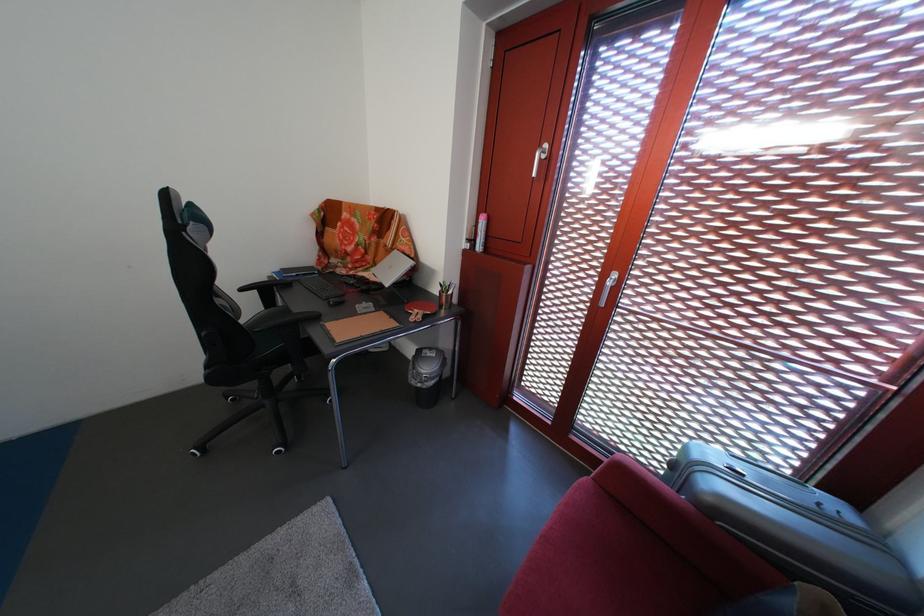
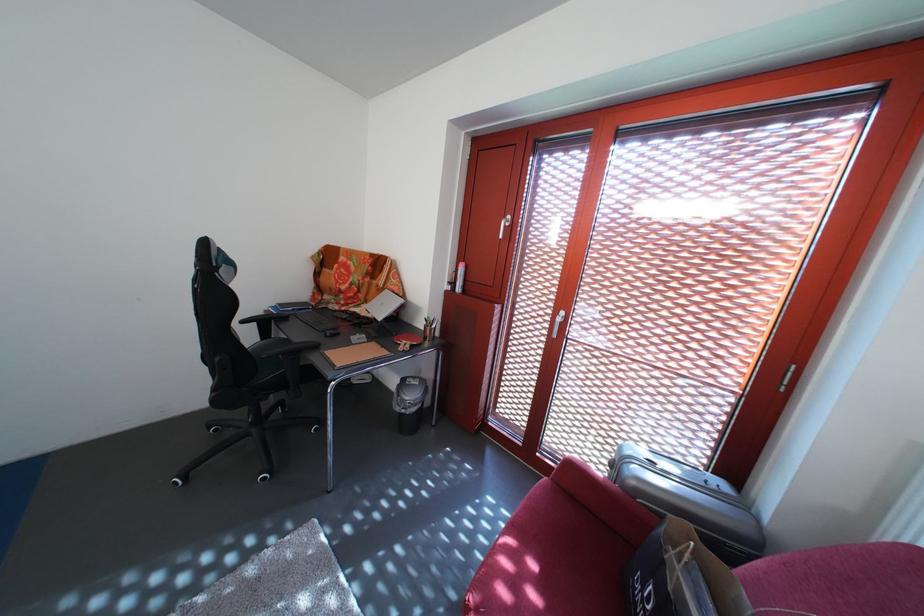
Find the pixel in the second image that matches the point at 280,308 in the first image.

(275, 339)